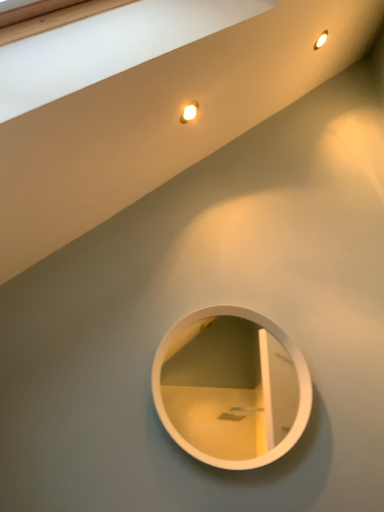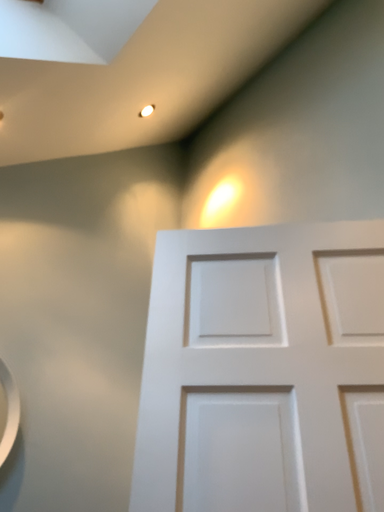
Question: Which way did the camera rotate in the video?

Choices:
 (A) rotated right
 (B) rotated left

Answer: (A)